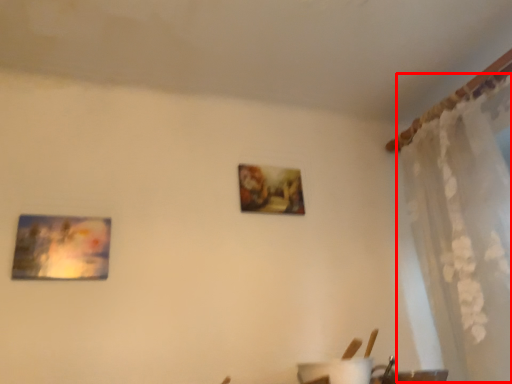
Question: From the image's perspective, where is curtain (annotated by the red box) located in relation to picture frame in the image?

Choices:
 (A) below
 (B) above

Answer: (B)